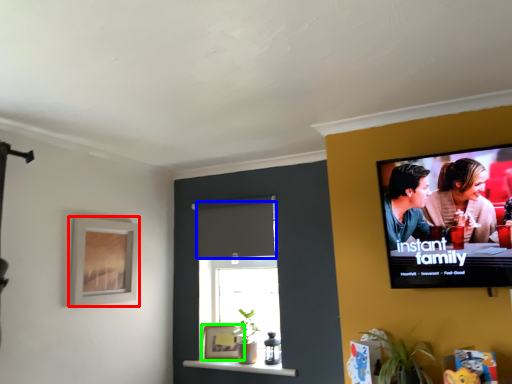
Question: Based on their relative distances, which object is nearer to picture frame (highlighted by a red box)? Choose from curtain (highlighted by a blue box) and picture frame (highlighted by a green box).

Choices:
 (A) curtain
 (B) picture frame

Answer: (A)